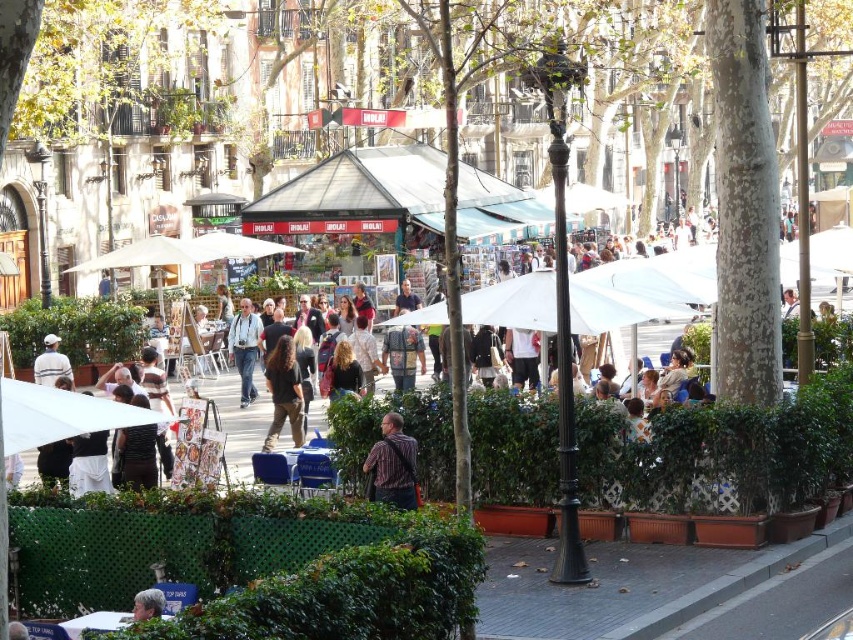
From the picture: You are a photographer trying to capture a candid shot of both the dark brown hair at center and the light brown hair at center. Since you want to ensure both subjects are in focus, you need to know which has a smaller width. Which one has a smaller width?

The dark brown hair at center has a smaller width than the light brown hair at center according to the description.

You are a photographer trying to capture a shot of the white matte umbrella at lower left and the dark brown hair at center. Which object should you focus on first if you want to ensure both are in the frame without moving the camera?

The white matte umbrella at lower left is larger in size than the dark brown hair at center, so you should focus on the white matte umbrella at lower left first to ensure it fits within the frame before adjusting for the smaller dark brown hair at center.